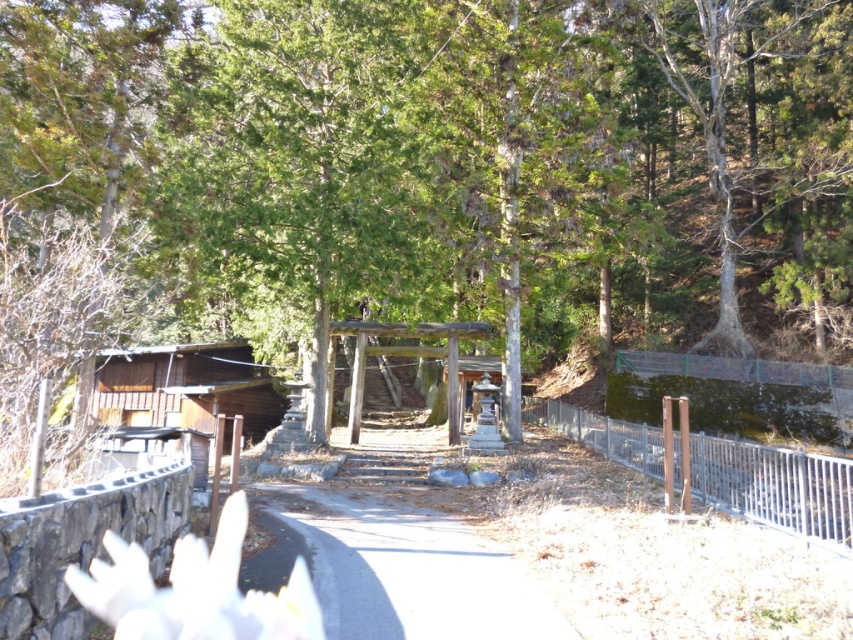
Is gray concrete path at center thinner than metallic silver fence at right?

In fact, gray concrete path at center might be wider than metallic silver fence at right.

Between gray concrete path at center and metallic silver fence at right, which one appears on the right side from the viewer's perspective?

From the viewer's perspective, metallic silver fence at right appears more on the right side.

Measure the distance between point [292,484] and camera.

Point [292,484] is 15.59 meters away from camera.

The image size is (853, 640). Find the location of `gray concrete path at center`. gray concrete path at center is located at coordinates (410, 572).

Does point (735, 88) lie in front of point (262, 429)?

No, (735, 88) is behind (262, 429).

Is green leafy tree at center shorter than brown wooden cabin at left?

No, green leafy tree at center is not shorter than brown wooden cabin at left.

This screenshot has height=640, width=853. Identify the location of green leafy tree at center. (450, 164).

Is point (354, 566) less distant than point (260, 433)?

Yes, it is in front of point (260, 433).

Does gray concrete path at center have a greater height compared to brown wooden cabin at left?

No, gray concrete path at center is not taller than brown wooden cabin at left.

Find the location of a particular element. The width and height of the screenshot is (853, 640). gray concrete path at center is located at coordinates (410, 572).